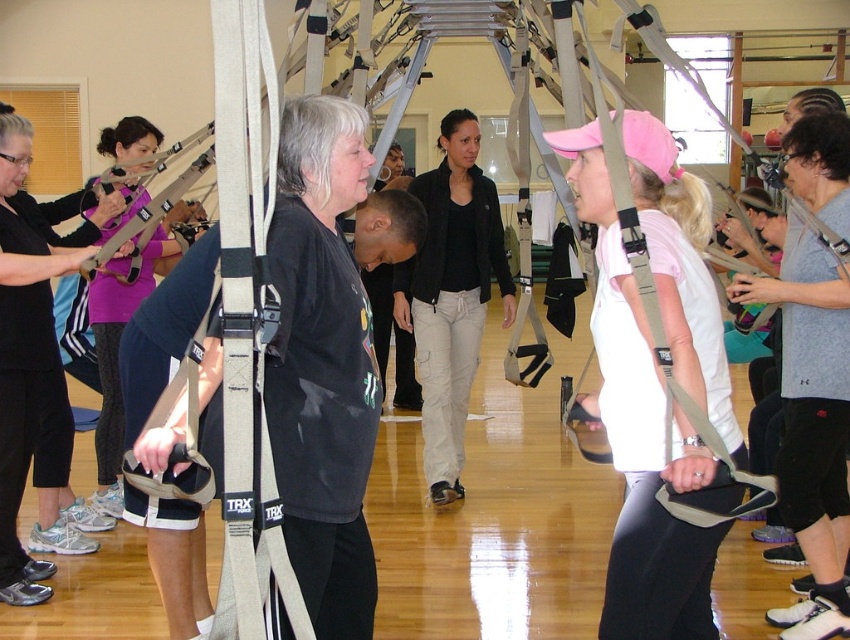
You are a photographer setting up for a group photo in the gym. You need to ensure that the gray cotton shirt at center and the black cotton jacket at center are both visible in the frame. Given their height difference, which clothing item might you need to adjust the camera angle to better capture?

The gray cotton shirt at center has a lesser height compared to the black cotton jacket at center. To ensure both are visible, you might angle the camera slightly upward to capture the taller black cotton jacket at center while keeping the shorter gray cotton shirt at center in view.

You are a participant in the fitness class and want to retrieve your water bottle from the area near the door. You notice a matte black shirt at center located at point (323, 365). Can you walk straight from your current position to the door without passing through the area where the matte black shirt at center is located?

The matte black shirt at center is located at point (323, 365). Since the door is in the background and the shirt is at center, walking straight towards the door would require passing through the area where the matte black shirt at center is located.